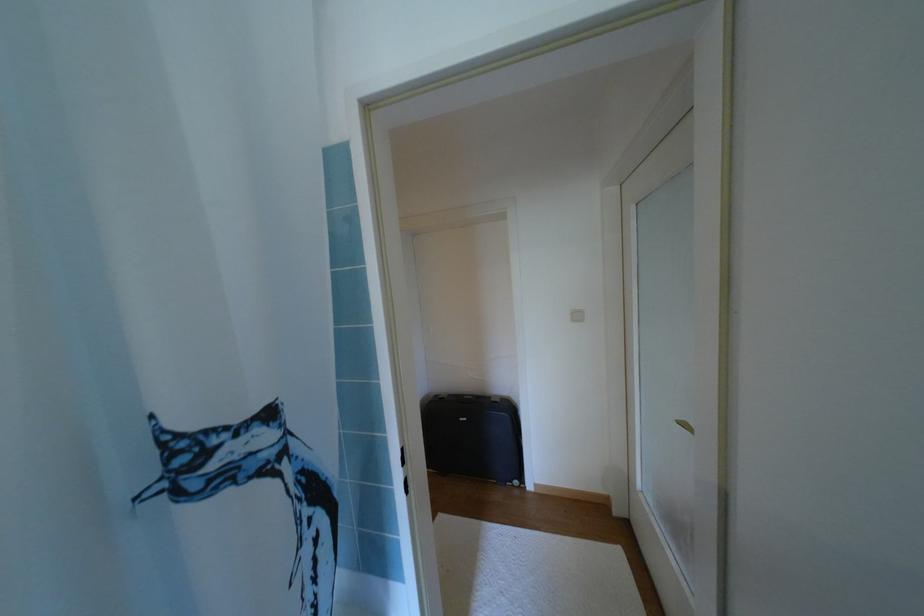
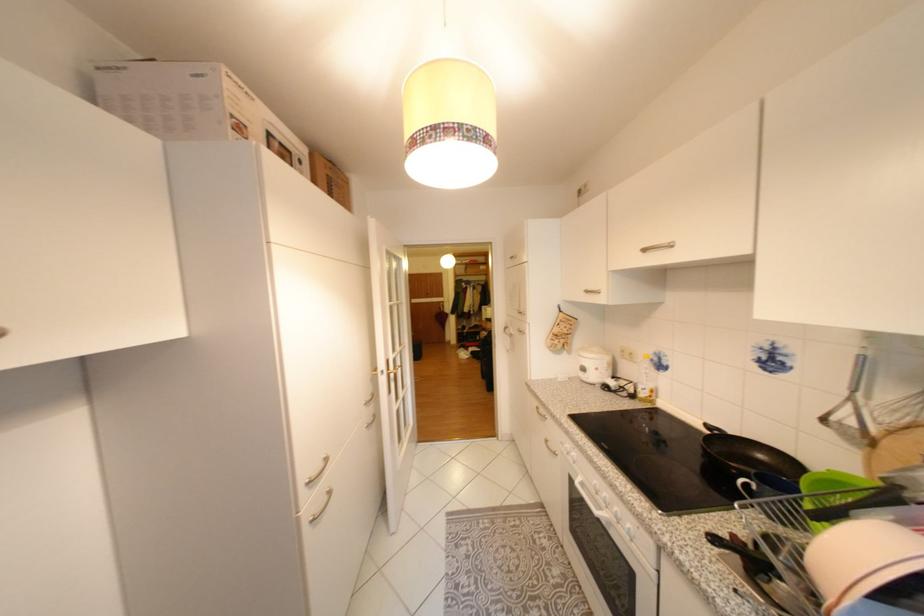
Question: The images are taken continuously from a first-person perspective. In which direction are you moving?

Choices:
 (A) Left
 (B) Right
 (C) Forward
 (D) Backward

Answer: (A)